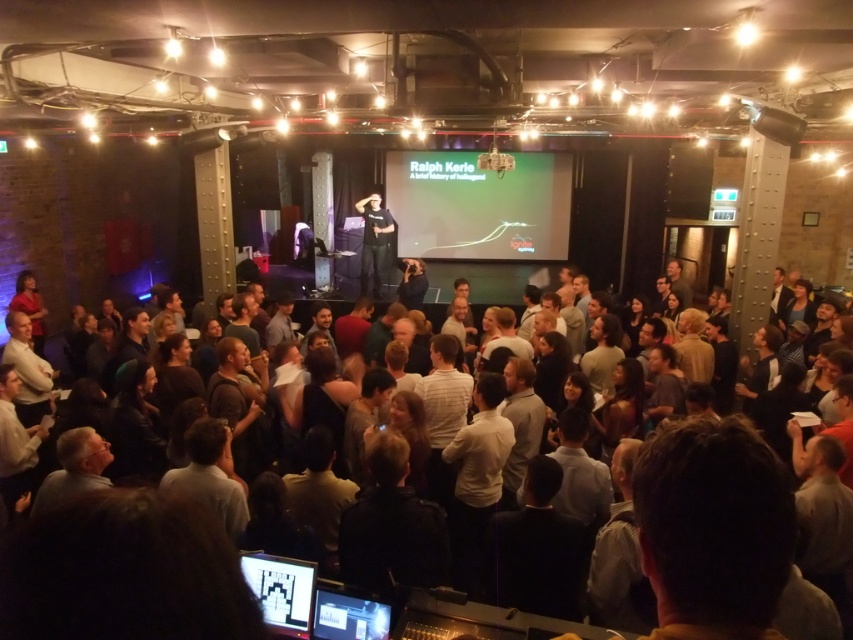
You are sitting in the audience and want to take a photo of the speaker. The speaker is wearing a black matte shirt at center, and there is a matte black screen at lower center. Which object is positioned to the right of the other?

The matte black screen at lower center is positioned to the right of the black matte shirt at center.

You are standing at point (380,230) and want to move to the stage. Is there a clear path from your current position to the stage without passing through point (784,564)?

Point (784,564) is in front of point (380,230). Since you want to move to the stage, you need to go around point (784,564) to avoid it, so there is a clear path available.

You are an attendee at the conference and want to find the dark brown leather jacket at center. Based on the coordinates provided, where should you look in the image?

The dark brown leather jacket at center is located at point coordinates (x=721, y=534).